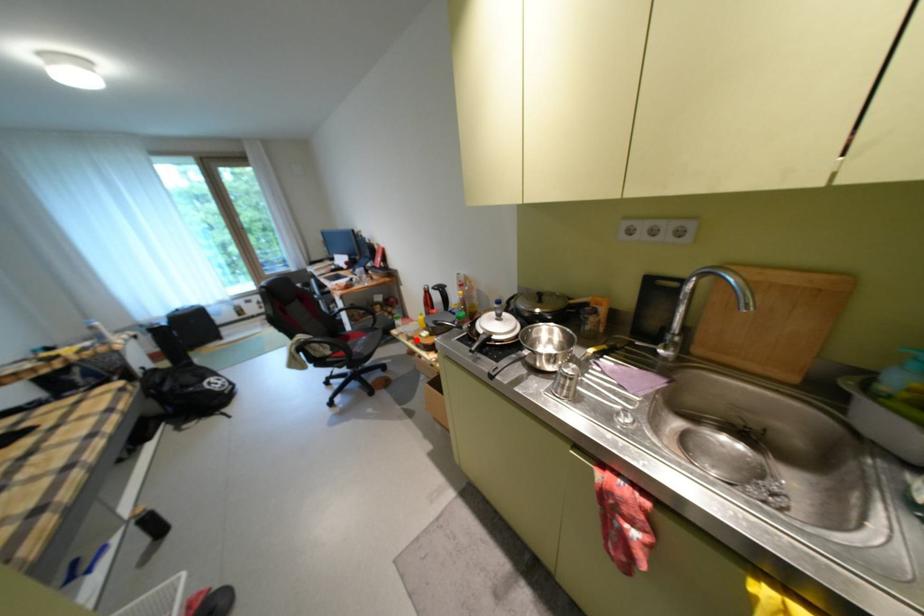
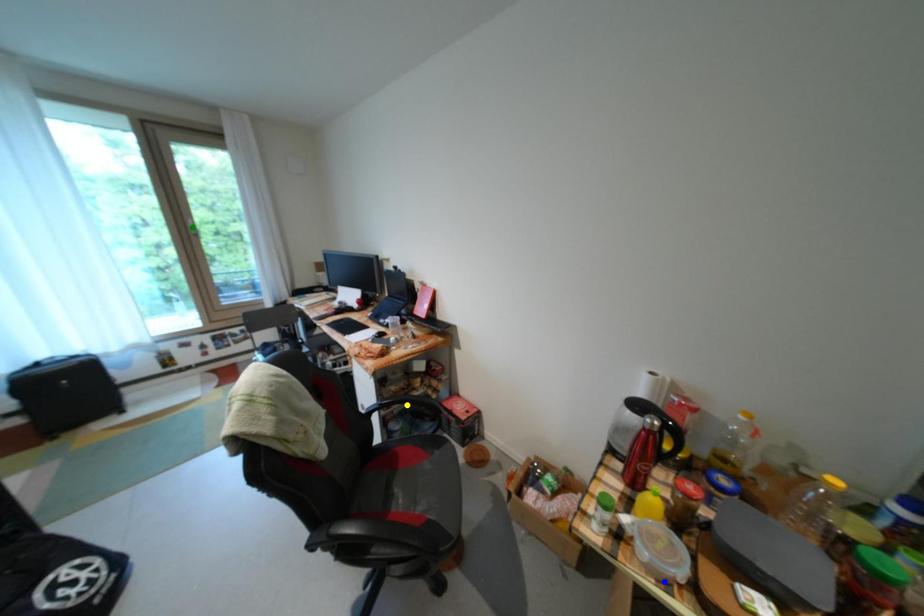
Question: I am providing you with two images of the same scene from different viewpoints. A red point is marked on the first image. You are given multiple points on the second image. Can you choose the point in image 2 that corresponds to the point in image 1?

Choices:
 (A) green point
 (B) yellow point
 (C) blue point

Answer: (C)